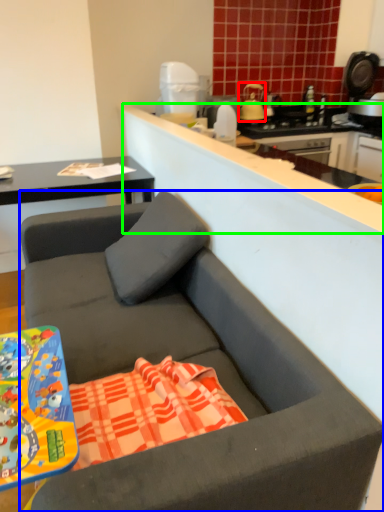
Question: Which object is the farthest from kitchen appliance (highlighted by a red box)? Choose among these: studio couch (highlighted by a blue box) or counter top (highlighted by a green box).

Choices:
 (A) studio couch
 (B) counter top

Answer: (A)